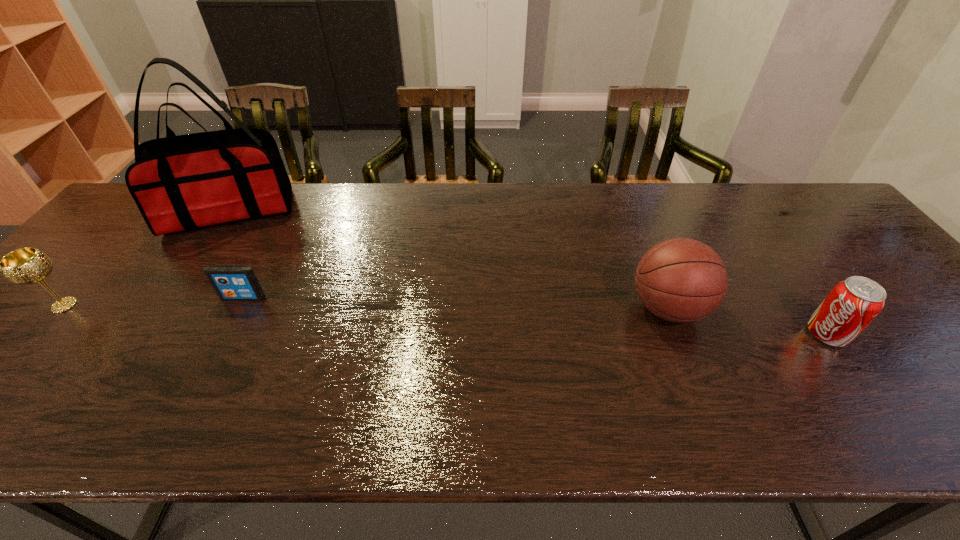
Where is `free region located 0.210m on the front of the rightmost object`? free region located 0.210m on the front of the rightmost object is located at coordinates (901, 441).

I want to click on free location located on the front screen of the iPod, so click(232, 320).

The width and height of the screenshot is (960, 540). I want to click on object present at the far edge, so click(179, 183).

I want to click on duffel bag present at the left edge, so click(179, 183).

Where is `chalice that is at the left edge`? The width and height of the screenshot is (960, 540). chalice that is at the left edge is located at coordinates (24, 266).

I want to click on object present at the far left corner, so click(179, 183).

In order to click on blank space at the far edge of the desktop in this screenshot , I will do pos(531,223).

Locate an element on the screen. free region at the near edge is located at coordinates (228, 417).

This screenshot has height=540, width=960. Find the location of `vacant point at the left edge`. vacant point at the left edge is located at coordinates (7, 338).

In the image, there is a desktop. Identify the location of vacant space at the far left corner. This screenshot has width=960, height=540. (139, 220).